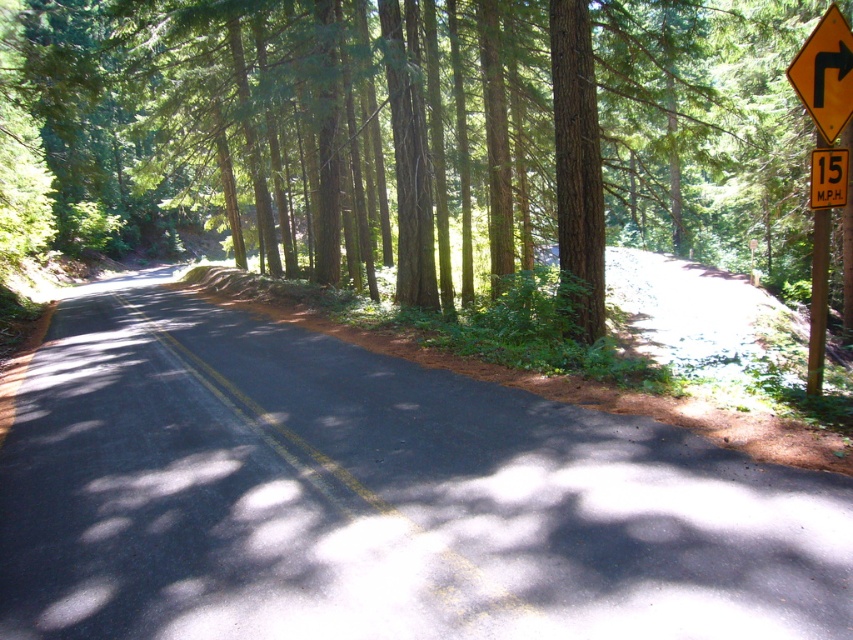
You are driving a car and approaching a curve on a forest road. You see a yellow reflective plastic at right and a yellow signpost at right. Which object is closer to the center of the road?

The yellow reflective plastic at right is closer to the center of the road because it is positioned to the left of the yellow signpost at right, meaning it is nearer to the road center compared to the signpost.